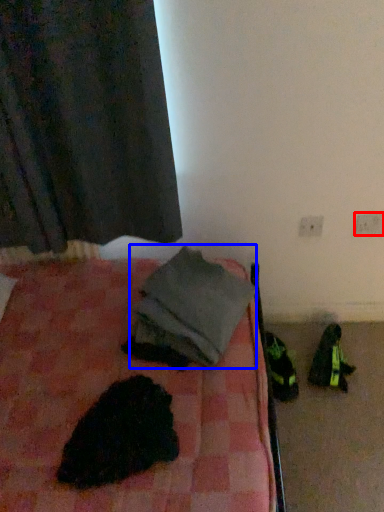
Question: Which of the following is the farthest to the observer, electric outlet (highlighted by a red box) or clothing (highlighted by a blue box)?

Choices:
 (A) electric outlet
 (B) clothing

Answer: (A)